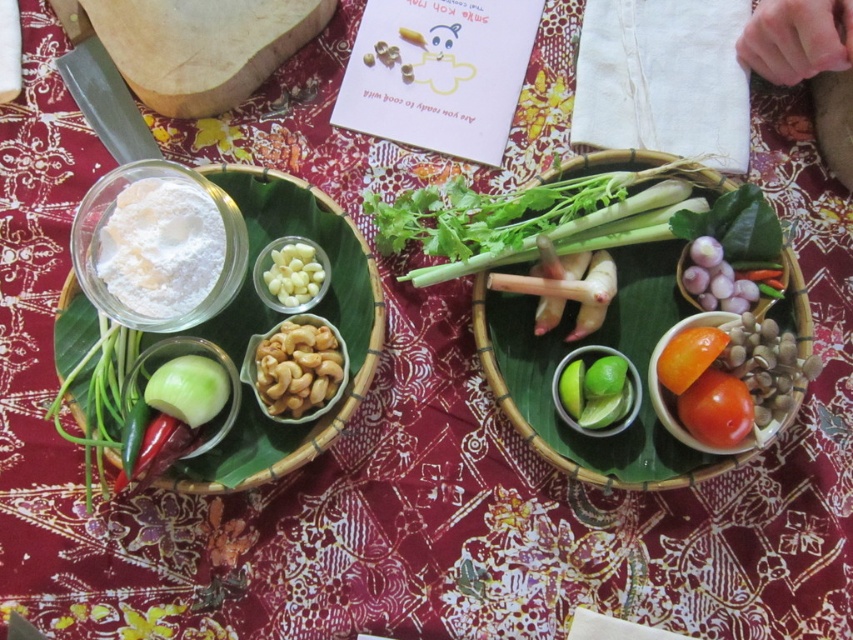
You are a chef preparing a dish and need to move a spice jar from the counter to the table. The table has a white cloth at upper right and a green leafy vegetable at upper right. If the spice jar is 3 inches in diameter, will it fit between them?

The white cloth at upper right is 5.88 inches away from the green leafy vegetable at upper right. Since the spice jar is 3 inches in diameter, it should fit between them as the distance is greater than the jar diameter.

Consider the image. You are a chef preparing a dish and need to access the green leafy vegetable at upper right. However, there is a white cloth at upper right covering it. Can you easily reach the vegetable without moving the cloth?

The white cloth at upper right is positioned over the green leafy vegetable at upper right, so you would need to move the cloth to access the vegetable.